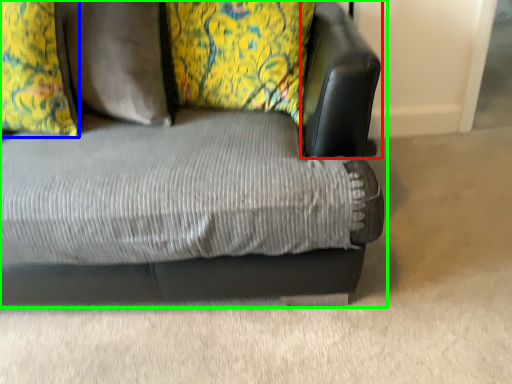
Question: Considering the real-world distances, which object is farthest from swivel chair (highlighted by a red box)? pillow (highlighted by a blue box) or studio couch (highlighted by a green box)?

Choices:
 (A) pillow
 (B) studio couch

Answer: (A)